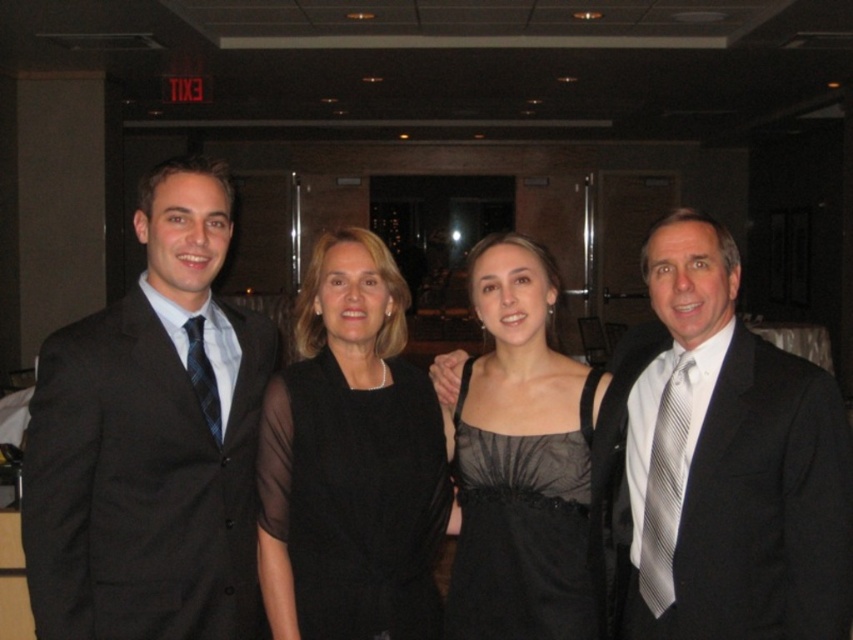
Is point (35, 502) positioned before point (682, 477)?

Yes, point (35, 502) is closer to viewer.

Is matte black suit at left shorter than gray striped tie at right?

No, matte black suit at left is not shorter than gray striped tie at right.

The height and width of the screenshot is (640, 853). What are the coordinates of `matte black suit at left` in the screenshot? It's located at (149, 442).

Is black silk suit at right above gray striped tie at right?

Correct, black silk suit at right is located above gray striped tie at right.

Is black silk suit at right to the right of gray striped tie at right from the viewer's perspective?

Indeed, black silk suit at right is positioned on the right side of gray striped tie at right.

Who is more distant from viewer, [815,461] or [650,512]?

The point [650,512] is more distant.

This screenshot has height=640, width=853. Find the location of `black silk suit at right`. black silk suit at right is located at coordinates (x=766, y=504).

From the picture: Does black silk suit at right have a lesser height compared to blue striped tie at left?

In fact, black silk suit at right may be taller than blue striped tie at left.

Between black silk suit at right and blue striped tie at left, which one has more height?

With more height is black silk suit at right.

You are a GUI agent. You are given a task and a screenshot of the screen. Output one action in this format:
    pyautogui.click(x=<x>, y=<y>)
    Task: Click on the black silk suit at right
    Image resolution: width=853 pixels, height=640 pixels.
    Given the screenshot: What is the action you would take?
    [766, 504]